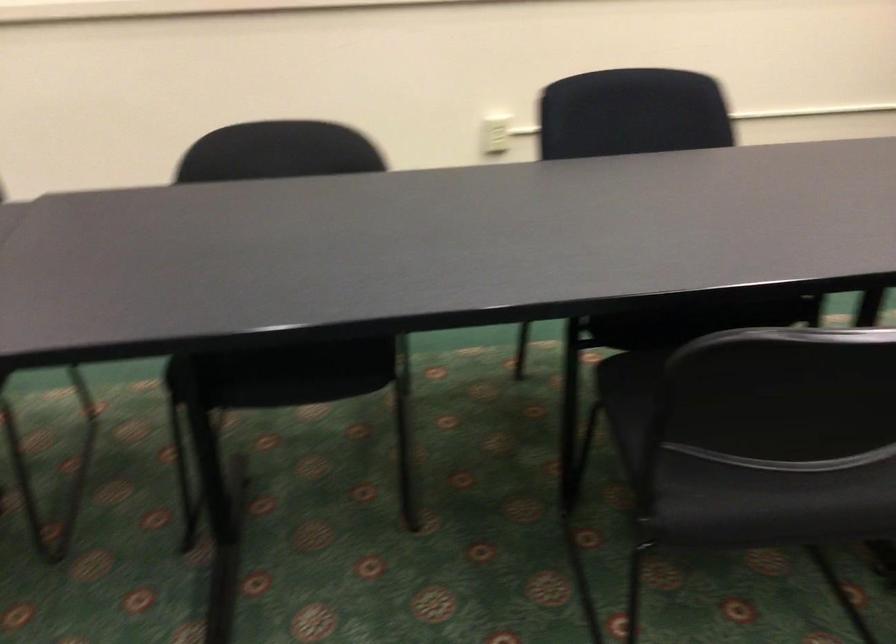
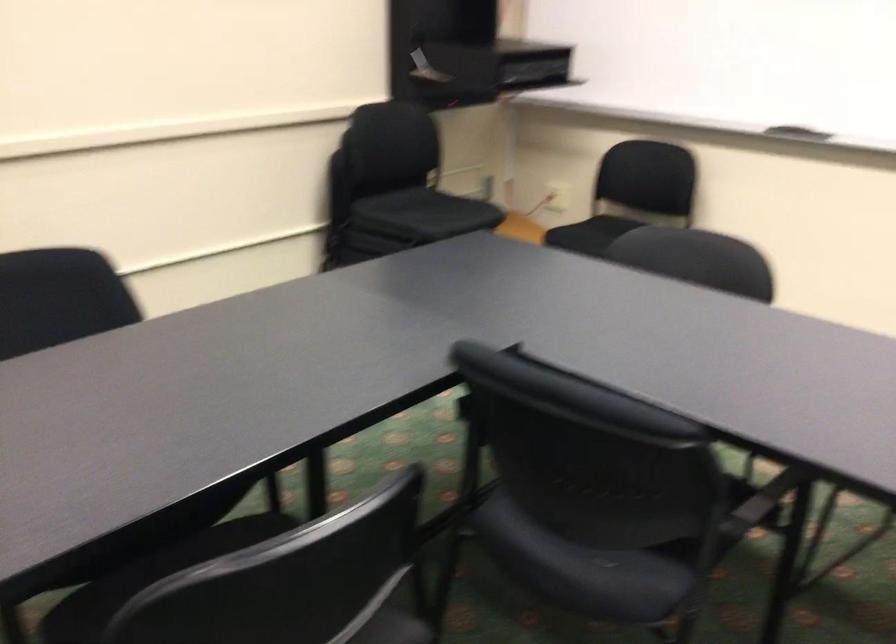
Question: Based on the continuous images, in which direction is the camera rotating? Reply with the corresponding letter.

Choices:
 (A) Left
 (B) Right
 (C) Up
 (D) Down

Answer: (B)